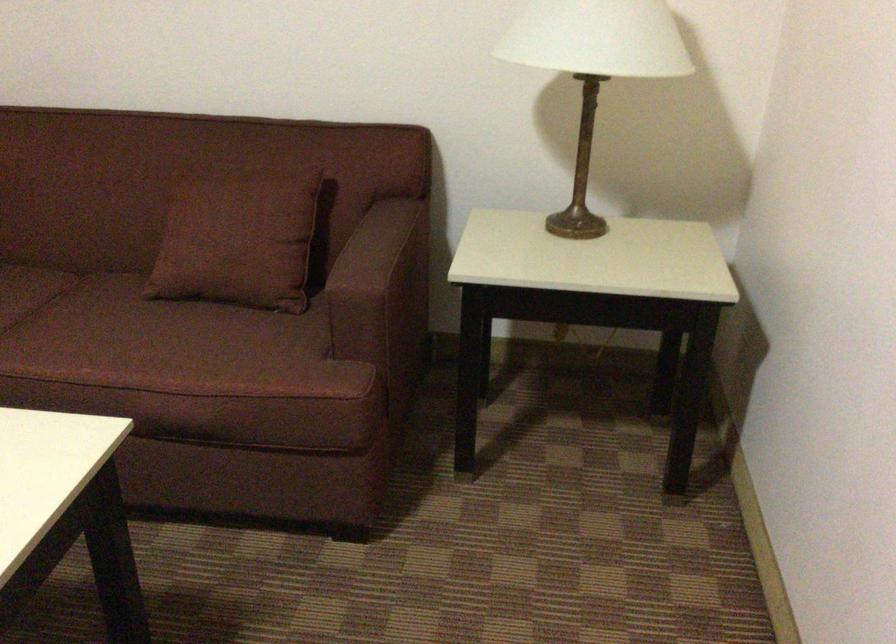
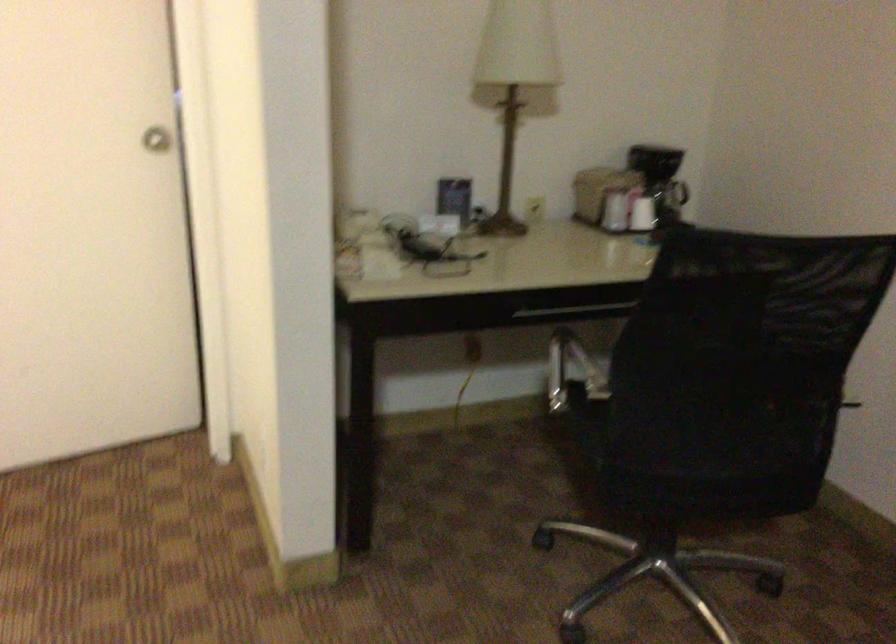
The first image is from the beginning of the video and the second image is from the end. How did the camera likely rotate when shooting the video?

The camera rotated toward right-down.